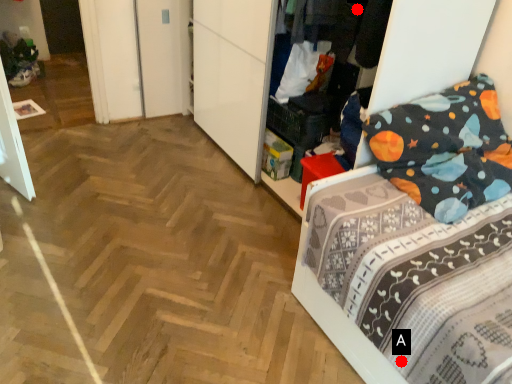
Question: Two points are circled on the image, labeled by A and B beside each circle. Which of the following is the farthest from the observer?

Choices:
 (A) A is further
 (B) B is further

Answer: (B)